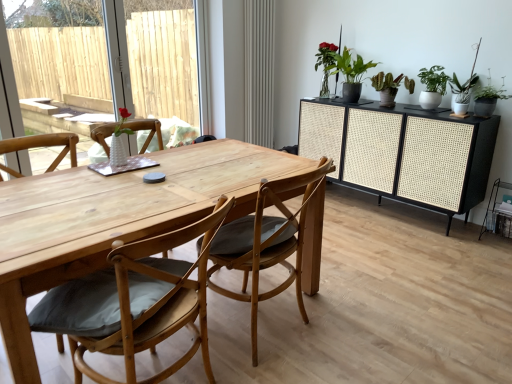
Question: From the image's perspective, is natural wood chair at center, arranged as the second chair when viewed from the left, on green matte plant at upper right, the third houseplant from the right?

Choices:
 (A) yes
 (B) no

Answer: (B)

Question: Is natural wood chair at center, arranged as the second chair when viewed from the left, at the left side of green matte plant at upper right, the first houseplant from the left?

Choices:
 (A) no
 (B) yes

Answer: (B)

Question: Does natural wood chair at center, arranged as the second chair when viewed from the left, come behind green matte plant at upper right, the first houseplant from the left?

Choices:
 (A) no
 (B) yes

Answer: (A)

Question: Is natural wood chair at center, arranged as the second chair when viewed from the left, at the right side of green matte plant at upper right, the first houseplant from the left?

Choices:
 (A) yes
 (B) no

Answer: (B)

Question: Is natural wood chair at center, arranged as the second chair when viewed from the left, surrounding green matte plant at upper right, the first houseplant from the left?

Choices:
 (A) no
 (B) yes

Answer: (A)

Question: Considering the relative sizes of natural wood chair at center, arranged as the second chair when viewed from the left, and green matte plant at upper right, the third houseplant from the right, in the image provided, is natural wood chair at center, arranged as the second chair when viewed from the left, wider than green matte plant at upper right, the third houseplant from the right,?

Choices:
 (A) yes
 (B) no

Answer: (A)

Question: Is green matte plant at upper right, the third houseplant from the right, looking in the opposite direction of green matte plant at upper right, the first houseplant viewed from the right?

Choices:
 (A) no
 (B) yes

Answer: (A)

Question: From a real-world perspective, is green matte plant at upper right, the first houseplant from the left, over green matte plant at upper right, which is the third houseplant from left to right?

Choices:
 (A) no
 (B) yes

Answer: (B)

Question: From a real-world perspective, is green matte plant at upper right, the third houseplant from the right, under green matte plant at upper right, the first houseplant viewed from the right?

Choices:
 (A) yes
 (B) no

Answer: (B)

Question: Does green matte plant at upper right, the third houseplant from the right, have a lesser height compared to green matte plant at upper right, the first houseplant viewed from the right?

Choices:
 (A) yes
 (B) no

Answer: (B)

Question: Is green matte plant at upper right, the third houseplant from the right, in contact with green matte plant at upper right, the first houseplant viewed from the right?

Choices:
 (A) no
 (B) yes

Answer: (A)

Question: Is green matte plant at upper right, the third houseplant from the right, thinner than green matte plant at upper right, the first houseplant viewed from the right?

Choices:
 (A) no
 (B) yes

Answer: (A)

Question: Is black woven cabinet at right closer to camera compared to matte gray radiator at center?

Choices:
 (A) yes
 (B) no

Answer: (A)